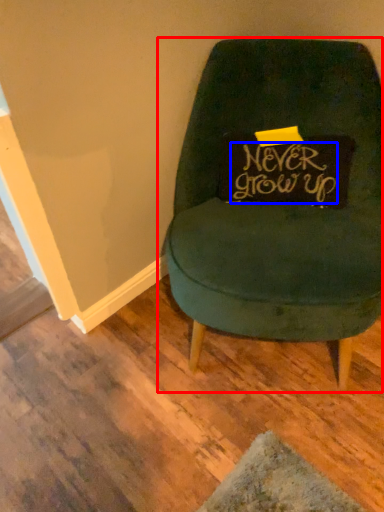
Question: Among these objects, which one is farthest to the camera, chair (highlighted by a red box) or writing (highlighted by a blue box)?

Choices:
 (A) chair
 (B) writing

Answer: (B)